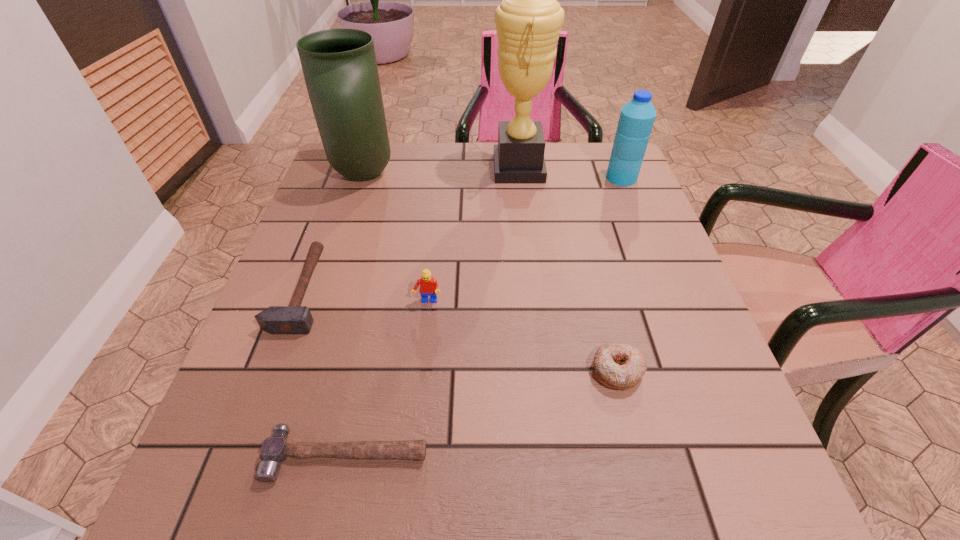
Find the location of `vacant space that satisfies the following two spatial constraints: 1. at the front of the doughnut with handles; 2. on the right side of the trophy cup`. vacant space that satisfies the following two spatial constraints: 1. at the front of the doughnut with handles; 2. on the right side of the trophy cup is located at coordinates (541, 370).